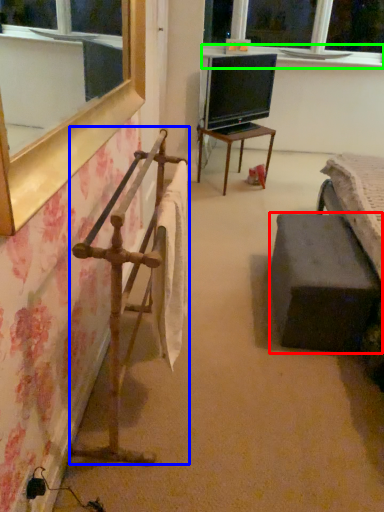
Question: Based on their relative distances, which object is nearer to furniture (highlighted by a red box)? Choose from rail (highlighted by a blue box) and window sill (highlighted by a green box).

Choices:
 (A) rail
 (B) window sill

Answer: (A)